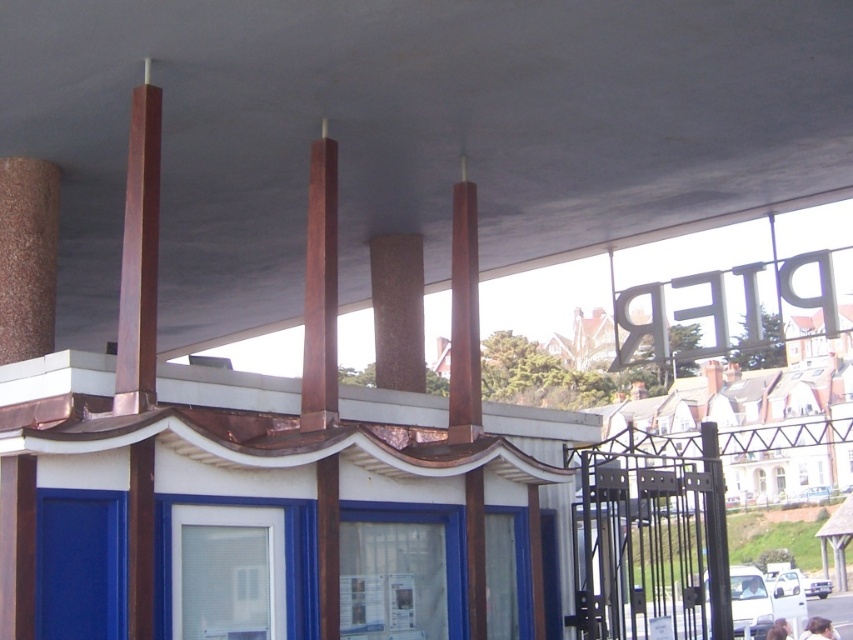
You are standing at the entrance of the building and see two points marked on the ceiling. The first point is at coordinate point (41, 275) and the second is at point (413, 328). Which point is closer to you?

Point (41, 275) is in front of point (413, 328), so the first point is closer to you.

You are standing in the building and want to locate the brown textured chimney at left from the rustic wood beams at center. Which direction should you face?

The rustic wood beams at center is to the right of the brown textured chimney at left, so to locate the brown textured chimney at left from the rustic wood beams at center, you should face to the left.